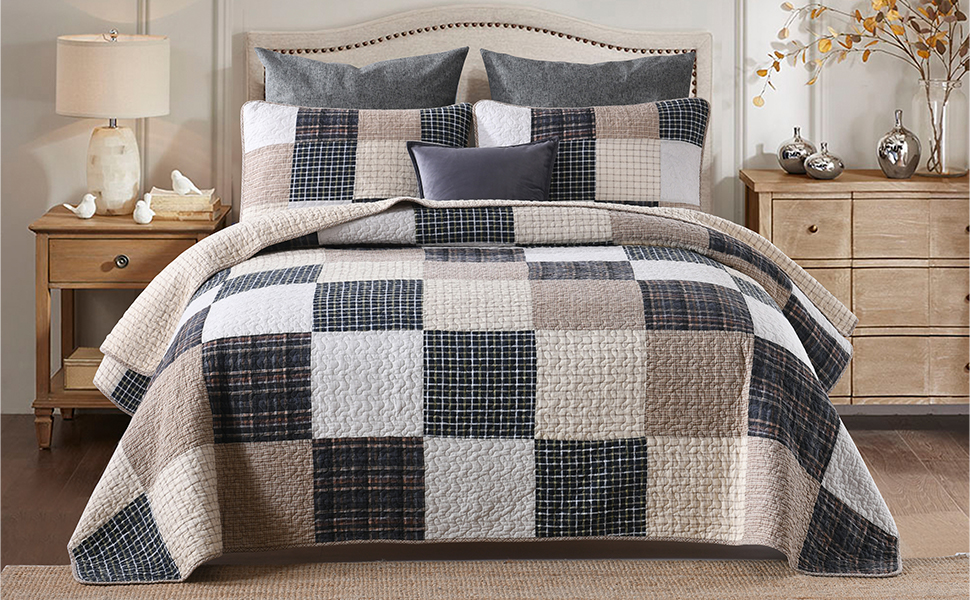
At what (x,y) coordinates should I click in order to perform the action: click on metal ornament. Please return your answer as a coordinate pair (x, y). Looking at the image, I should click on (831, 166), (783, 154), (890, 158).